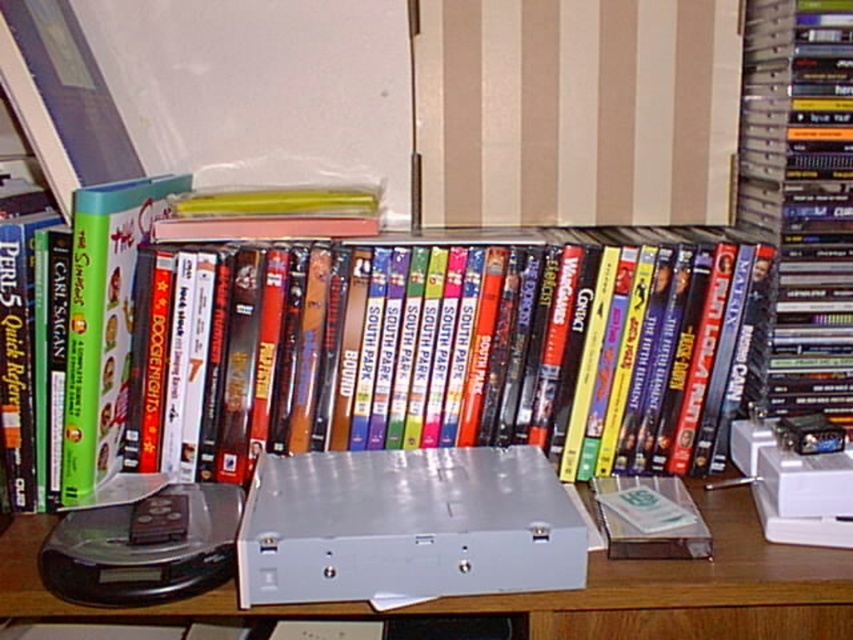
Who is shorter, hardcover book at center or silver metallic computer desk at center?

With less height is silver metallic computer desk at center.

Is hardcover book at center closer to the viewer compared to silver metallic computer desk at center?

No, it is behind silver metallic computer desk at center.

At what (x,y) coordinates should I click in order to perform the action: click on hardcover book at center. Please return your answer as a coordinate pair (x, y). Looking at the image, I should click on (372, 348).

Is point (401, 412) closer to viewer compared to point (827, 356)?

That is True.

Is hardcover book at center below hardcover book at right?

Yes, hardcover book at center is below hardcover book at right.

Does point (659, 326) come farther from viewer compared to point (766, 371)?

No, (659, 326) is closer to viewer.

Where is `hardcover book at center`? Image resolution: width=853 pixels, height=640 pixels. hardcover book at center is located at coordinates (372, 348).

Can you confirm if hardcover book at right is thinner than silver metallic computer desk at center?

Correct, hardcover book at right's width is less than silver metallic computer desk at center's.

Who is shorter, hardcover book at right or silver metallic computer desk at center?

Standing shorter between the two is silver metallic computer desk at center.

Who is more forward, (770, 381) or (850, 620)?

Point (850, 620) is in front.

Find the location of a particular element. The width and height of the screenshot is (853, 640). hardcover book at right is located at coordinates (799, 202).